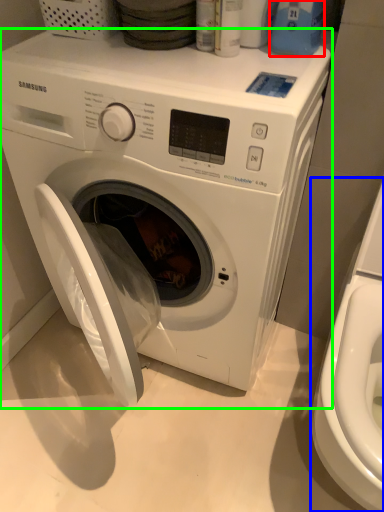
Question: Based on their relative distances, which object is farther from cleaning product (highlighted by a red box)? Choose from washer (highlighted by a blue box) and washing machine (highlighted by a green box).

Choices:
 (A) washer
 (B) washing machine

Answer: (A)